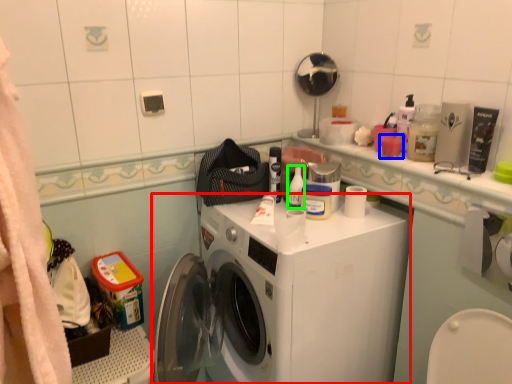
Question: Which object is positioned farthest from washing machine (highlighted by a red box)? Select from toiletry (highlighted by a blue box) and toiletry (highlighted by a green box).

Choices:
 (A) toiletry
 (B) toiletry

Answer: (A)